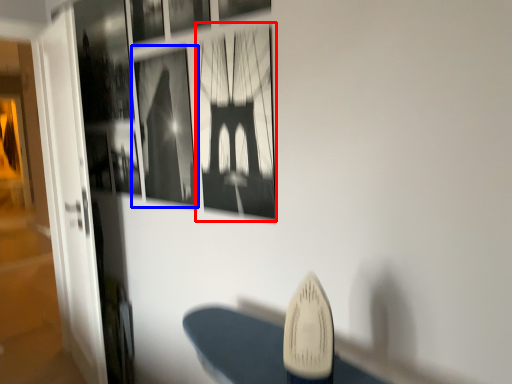
Question: Which point is further to the camera, picture frame (highlighted by a red box) or picture frame (highlighted by a blue box)?

Choices:
 (A) picture frame
 (B) picture frame

Answer: (B)